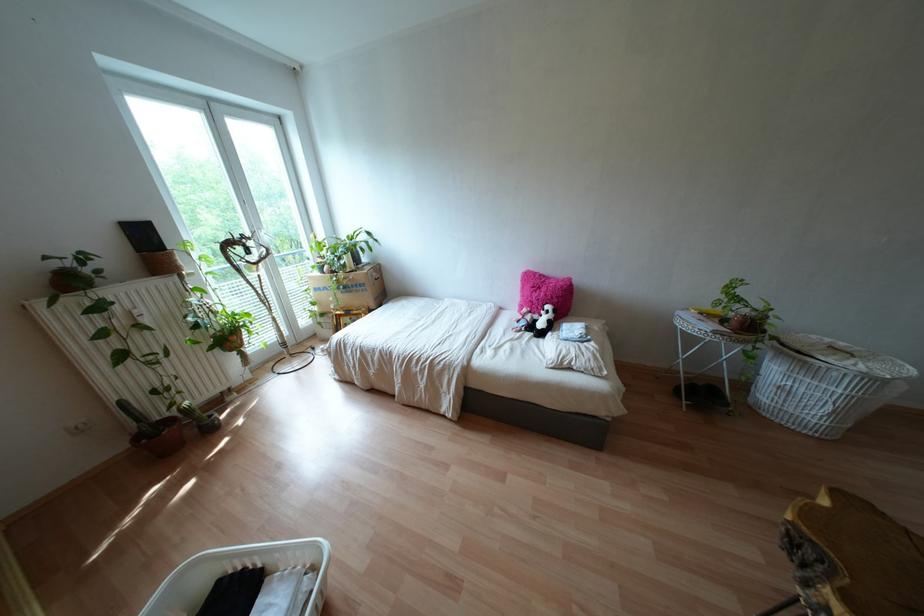
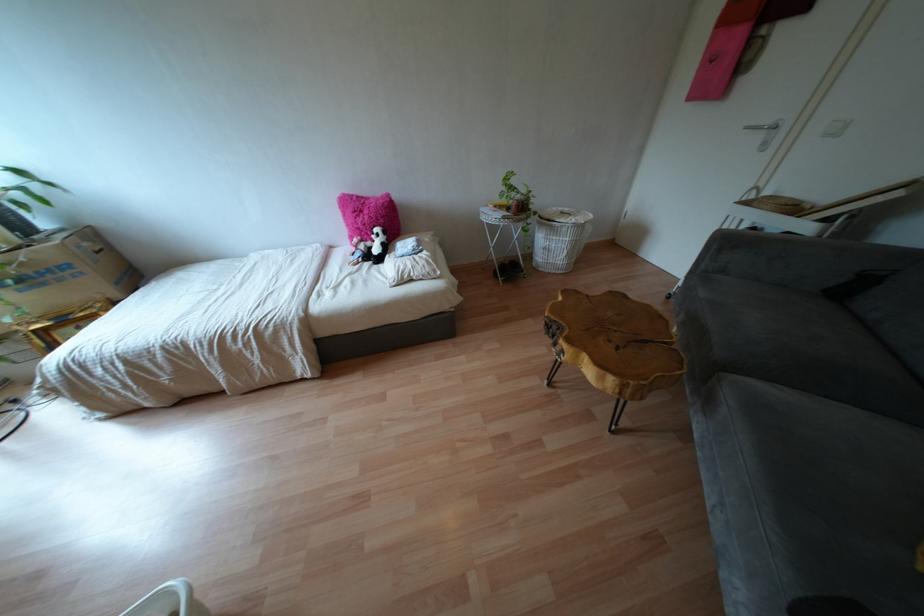
Find the pixel in the second image that matches [512,339] in the first image.

(349, 274)